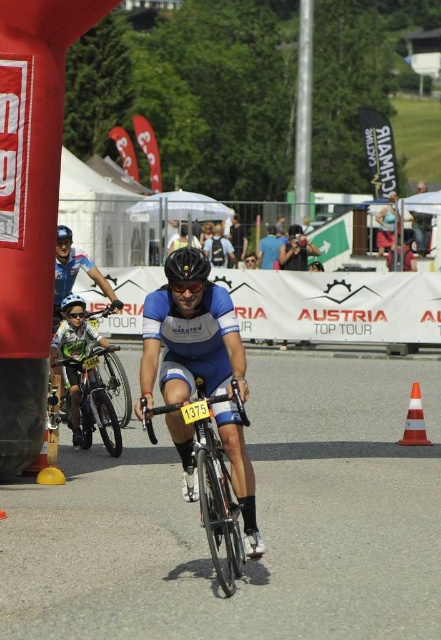
Who is taller, orange reflective cone at lower right or matte black helmet at center?

Standing taller between the two is orange reflective cone at lower right.

Is orange reflective cone at lower right further to the viewer compared to matte black helmet at center?

Yes, orange reflective cone at lower right is further from the viewer.

Where is `orange reflective cone at lower right`? The width and height of the screenshot is (441, 640). orange reflective cone at lower right is located at coordinates coord(414,420).

Measure the distance between green matte bicycle at left and matte black helmet at center.

They are 34.34 inches apart.

Does green matte bicycle at left lie behind matte black helmet at center?

No.

Which is behind, point (74, 364) or point (66, 304)?

The point (74, 364) is more distant.

The image size is (441, 640). Find the location of `green matte bicycle at left`. green matte bicycle at left is located at coordinates (89, 401).

In the scene shown: Does shiny metallic bicycle at center have a larger size compared to matte black helmet at center?

Indeed, shiny metallic bicycle at center has a larger size compared to matte black helmet at center.

Which is above, shiny metallic bicycle at center or matte black helmet at center?

matte black helmet at center

Is point (216, 563) behind point (81, 307)?

No, it is not.

Locate an element on the screen. shiny metallic bicycle at center is located at coordinates (209, 483).